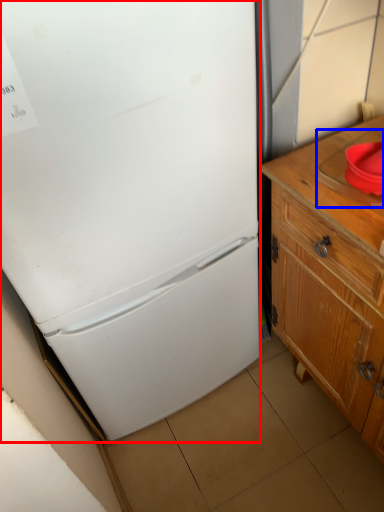
Question: Among these objects, which one is nearest to the camera, refrigerator (highlighted by a red box) or sink (highlighted by a blue box)?

Choices:
 (A) refrigerator
 (B) sink

Answer: (A)